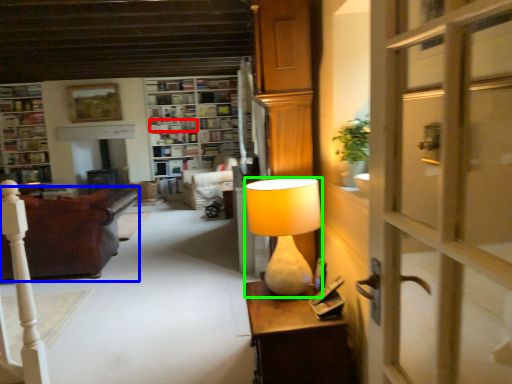
Question: Which is nearer to the book (highlighted by a red box)? studio couch (highlighted by a blue box) or lamp (highlighted by a green box).

Choices:
 (A) studio couch
 (B) lamp

Answer: (A)